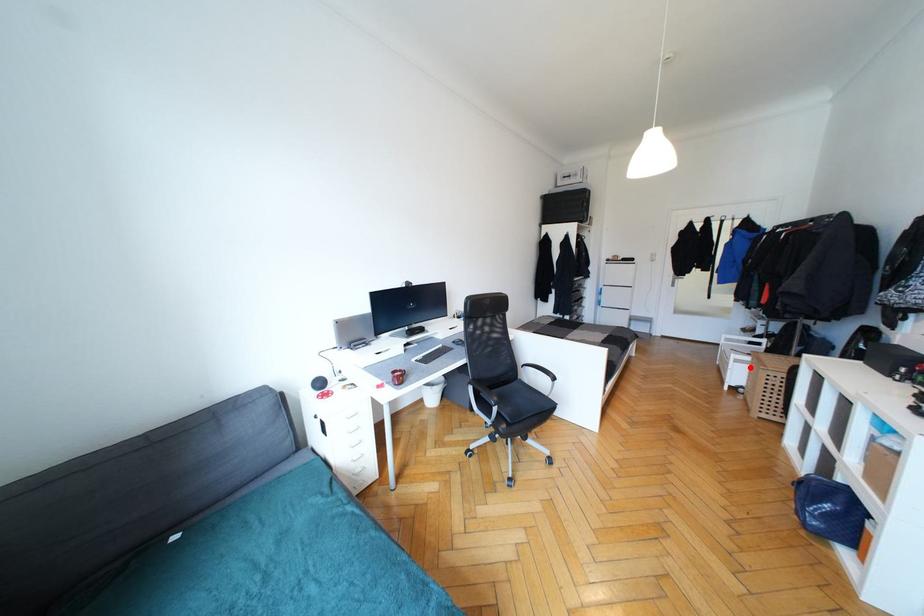
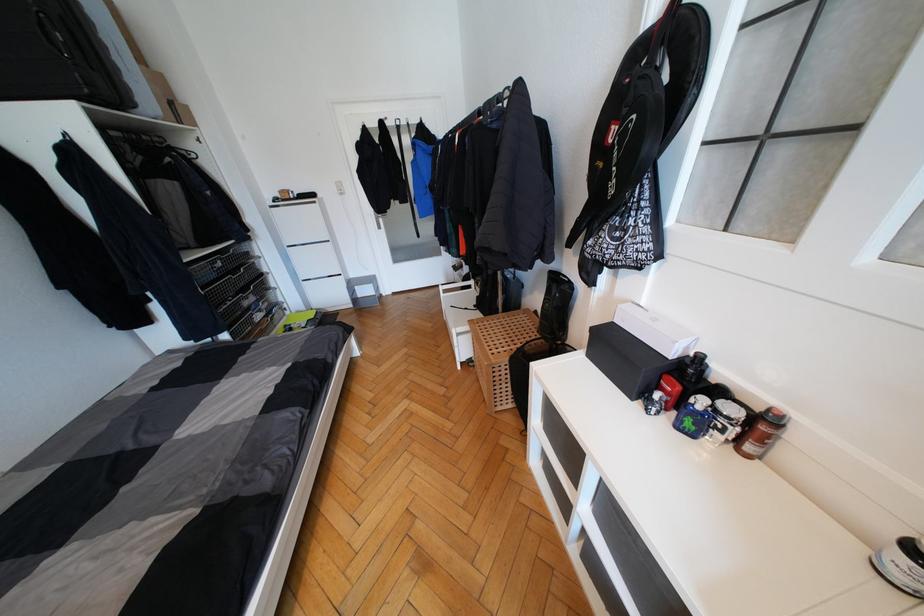
Find the pixel in the second image that matches the highlighted location in the first image.

(472, 338)